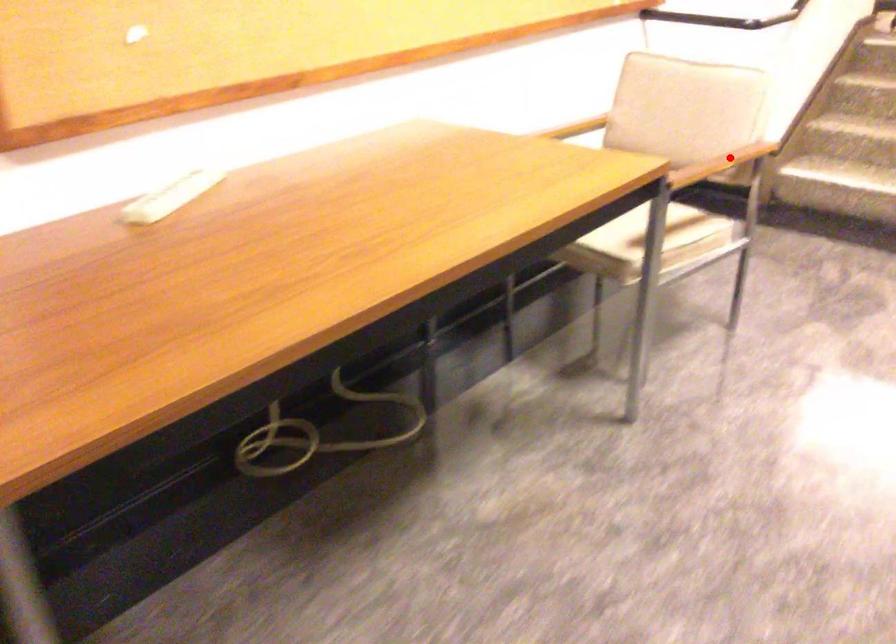
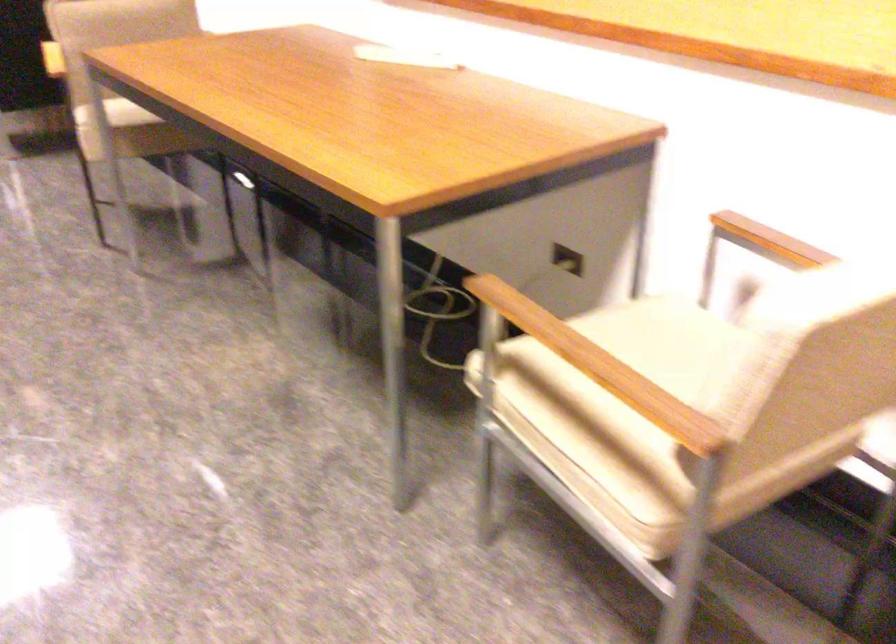
Question: I am providing you with two images of the same scene from different viewpoints. Given a red point in image1, look at the same physical point in image2. Is it:

Choices:
 (A) Closer to the viewpoint
 (B) Farther from the viewpoint

Answer: (A)